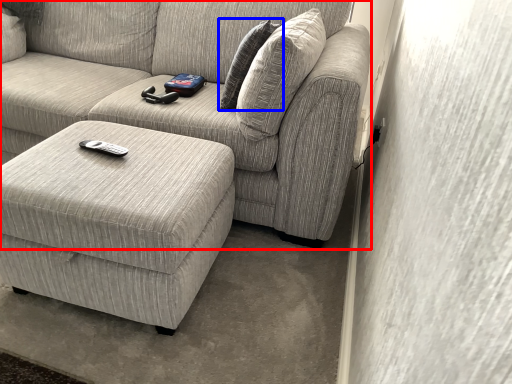
Question: Which object is closer to the camera taking this photo, studio couch (highlighted by a red box) or pillow (highlighted by a blue box)?

Choices:
 (A) studio couch
 (B) pillow

Answer: (A)